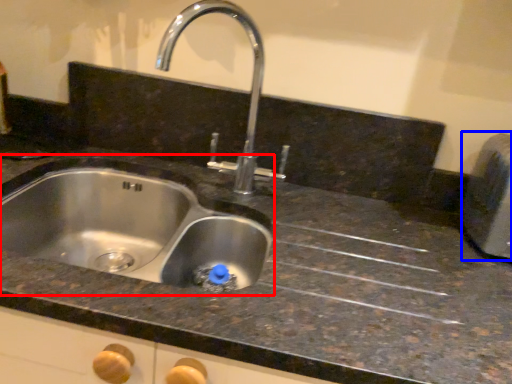
Question: Which point is further to the camera, sink (highlighted by a red box) or appliance (highlighted by a blue box)?

Choices:
 (A) sink
 (B) appliance

Answer: (B)